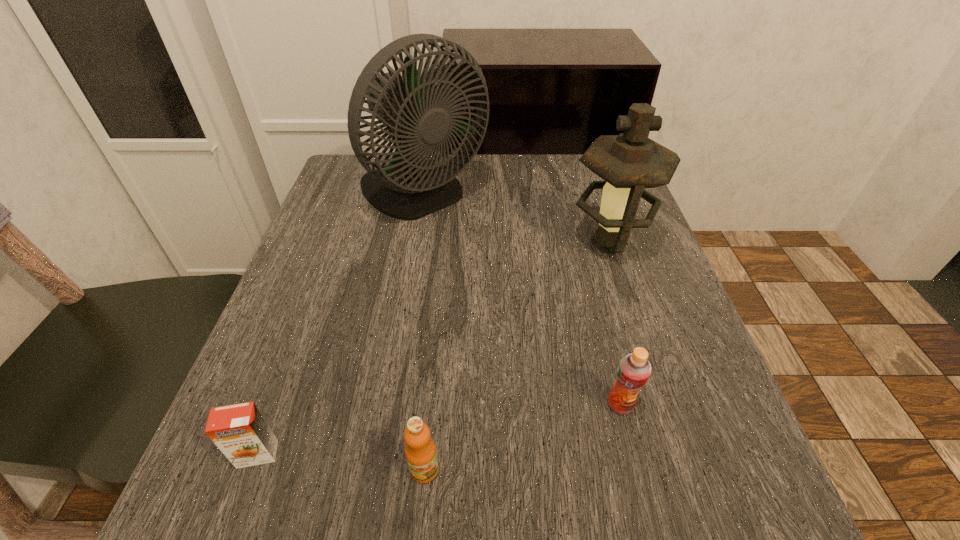
Locate an element on the screen. free space at the right edge of the desktop is located at coordinates (653, 341).

Identify the location of vacant area at the far left corner of the desktop. This screenshot has height=540, width=960. (383, 158).

Find the location of `vacant space at the near left corner`. vacant space at the near left corner is located at coordinates (257, 530).

Identify the location of vacant point at the near right corner. Image resolution: width=960 pixels, height=540 pixels. (662, 490).

The height and width of the screenshot is (540, 960). What are the coordinates of `vacant space that is in between the second orange juice from right to left and the tallest object` in the screenshot? It's located at (423, 332).

Identify the location of free space between the second orange juice from left to right and the leftmost orange juice. This screenshot has height=540, width=960. (341, 462).

Identify the location of blank region between the second orange juice from left to right and the leftmost orange juice. This screenshot has width=960, height=540. (341, 462).

Identify the location of vacant space that is in between the second orange juice from left to right and the fan. This screenshot has width=960, height=540. (423, 332).

Where is `free space between the second tallest object and the shortest object`? free space between the second tallest object and the shortest object is located at coordinates (433, 349).

The height and width of the screenshot is (540, 960). Identify the location of vacant area that lies between the fourth shortest object and the tallest object. point(516,219).